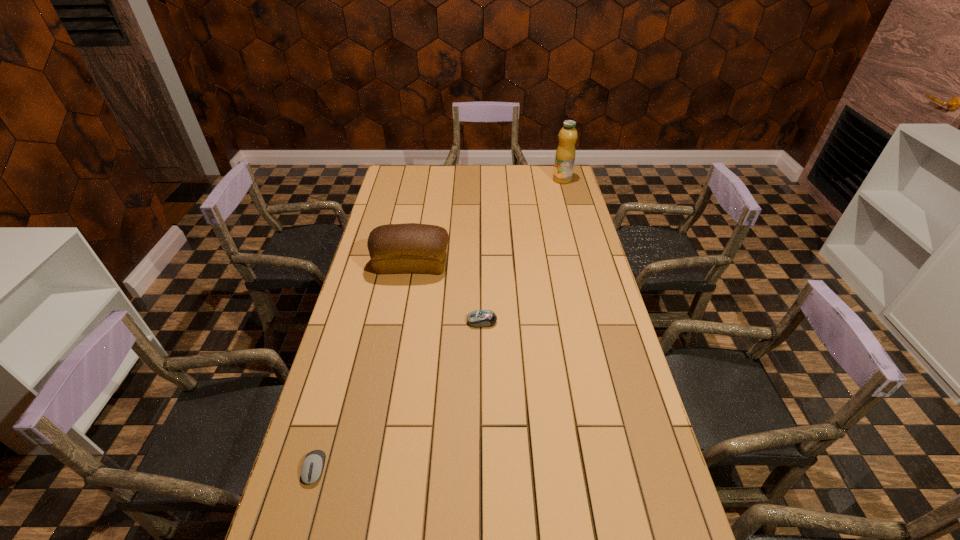
I want to click on vacant space at the left edge of the desktop, so click(x=321, y=425).

Identify the location of free space at the right edge of the desktop. (567, 221).

The height and width of the screenshot is (540, 960). Identify the location of vacant area that lies between the rightmost object and the bread. (487, 222).

This screenshot has height=540, width=960. Identify the location of free spot between the second farthest object and the rightmost object. (487, 222).

This screenshot has width=960, height=540. I want to click on vacant space in between the tallest object and the second nearest object, so click(522, 251).

Image resolution: width=960 pixels, height=540 pixels. Identify the location of free spot between the third farthest object and the bread. (446, 293).

At what (x,y) coordinates should I click in order to perform the action: click on free space that is in between the farther computer equipment and the farthest object. Please return your answer as a coordinate pair (x, y). Looking at the image, I should click on (522, 251).

This screenshot has width=960, height=540. What are the coordinates of `vacant area that lies between the fruit juice and the second farthest object` in the screenshot? It's located at (487, 222).

The width and height of the screenshot is (960, 540). What are the coordinates of `vacant space that's between the bread and the left computer equipment` in the screenshot? It's located at (364, 367).

Locate an element on the screen. the closest object relative to the left computer equipment is located at coordinates [x=478, y=318].